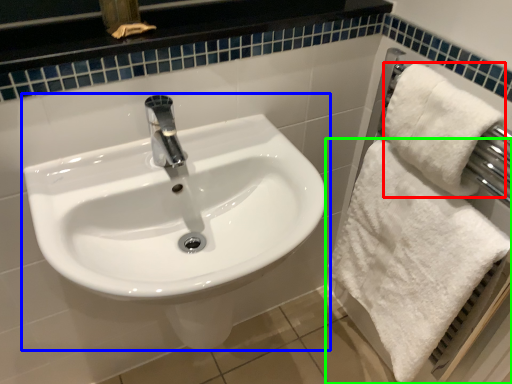
Question: Estimate the real-world distances between objects in this image. Which object is closer to bath towel (highlighted by a red box), sink (highlighted by a blue box) or towel (highlighted by a green box)?

Choices:
 (A) sink
 (B) towel

Answer: (B)